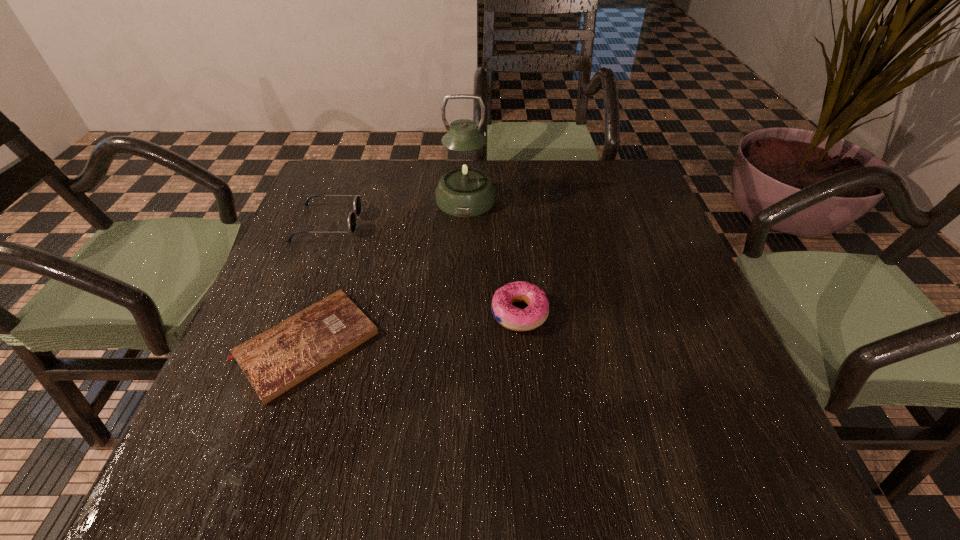
The image size is (960, 540). What are the coordinates of `sunglasses located at the left edge` in the screenshot? It's located at (357, 201).

Identify the location of Bible that is at the left edge. This screenshot has height=540, width=960. (276, 360).

Where is `object present at the far left corner`? The width and height of the screenshot is (960, 540). object present at the far left corner is located at coordinates (357, 201).

The width and height of the screenshot is (960, 540). I want to click on vacant space at the far edge of the desktop, so click(507, 199).

Locate an element on the screen. The height and width of the screenshot is (540, 960). vacant space at the near edge of the desktop is located at coordinates [619, 454].

Find the location of a particular element. The width and height of the screenshot is (960, 540). vacant region at the left edge of the desktop is located at coordinates (304, 242).

Locate an element on the screen. Image resolution: width=960 pixels, height=540 pixels. free space at the right edge of the desktop is located at coordinates (685, 364).

I want to click on blank space at the far left corner of the desktop, so click(x=362, y=176).

In the image, there is a desktop. Where is `free space at the near left corner`? free space at the near left corner is located at coordinates (275, 441).

Where is `free space between the sunglasses and the lantern`? free space between the sunglasses and the lantern is located at coordinates (396, 211).